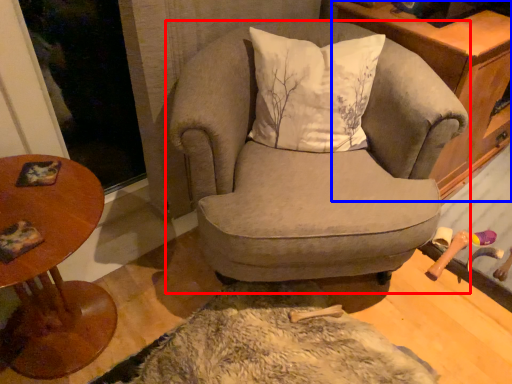
Question: Which object is closer to the camera taking this photo, chair (highlighted by a red box) or cabinetry (highlighted by a blue box)?

Choices:
 (A) chair
 (B) cabinetry

Answer: (A)